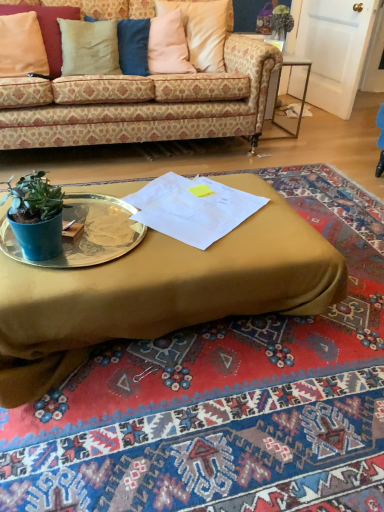
The width and height of the screenshot is (384, 512). Find the location of `free space in front of matte gold coffee table at center`. free space in front of matte gold coffee table at center is located at coordinates point(185,434).